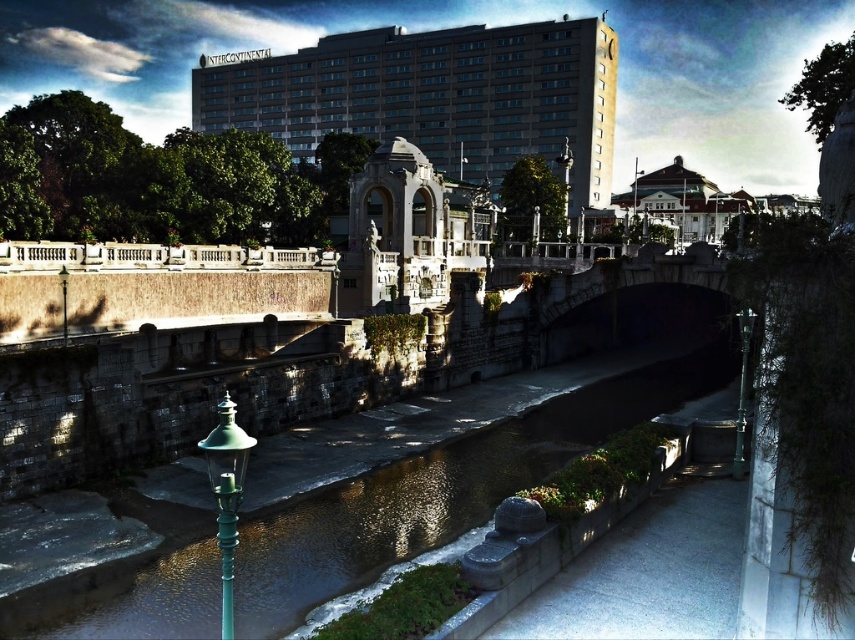
Which is above, green painted metal lamp post at lower left or green glass lamp post at right?

Positioned higher is green glass lamp post at right.

This screenshot has height=640, width=855. What do you see at coordinates (226, 493) in the screenshot?
I see `green painted metal lamp post at lower left` at bounding box center [226, 493].

Where is `green painted metal lamp post at lower left`? The image size is (855, 640). green painted metal lamp post at lower left is located at coordinates (226, 493).

Where is `green glass lamp post at right`? green glass lamp post at right is located at coordinates (741, 390).

You are a GUI agent. You are given a task and a screenshot of the screen. Output one action in this format:
    pyautogui.click(x=<x>, y=<y>)
    Task: Click on the green glass lamp post at right
    
    Given the screenshot: What is the action you would take?
    pyautogui.click(x=741, y=390)

Which of these two, blue glass building at upper center or green glass lamp post at center, stands shorter?

With less height is green glass lamp post at center.

Is point (550, 106) positioned in front of point (567, 184)?

That is False.

This screenshot has height=640, width=855. Find the location of `blue glass building at upper center`. blue glass building at upper center is located at coordinates (434, 97).